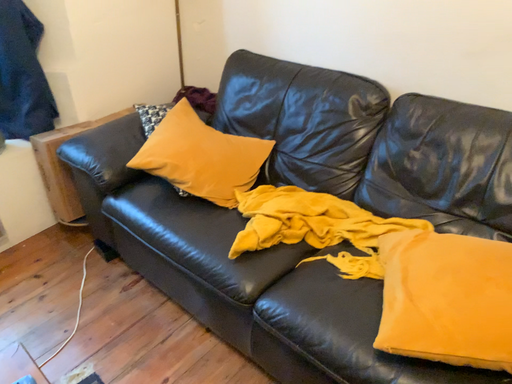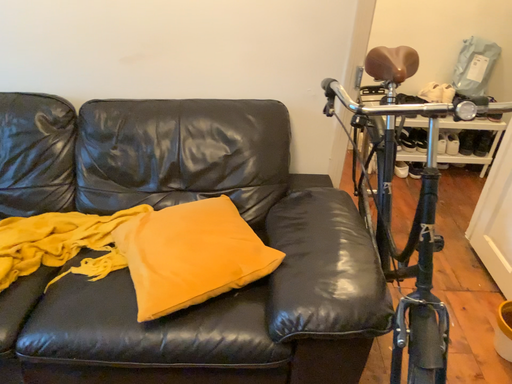
Question: Which way did the camera rotate in the video?

Choices:
 (A) rotated right
 (B) rotated left

Answer: (A)